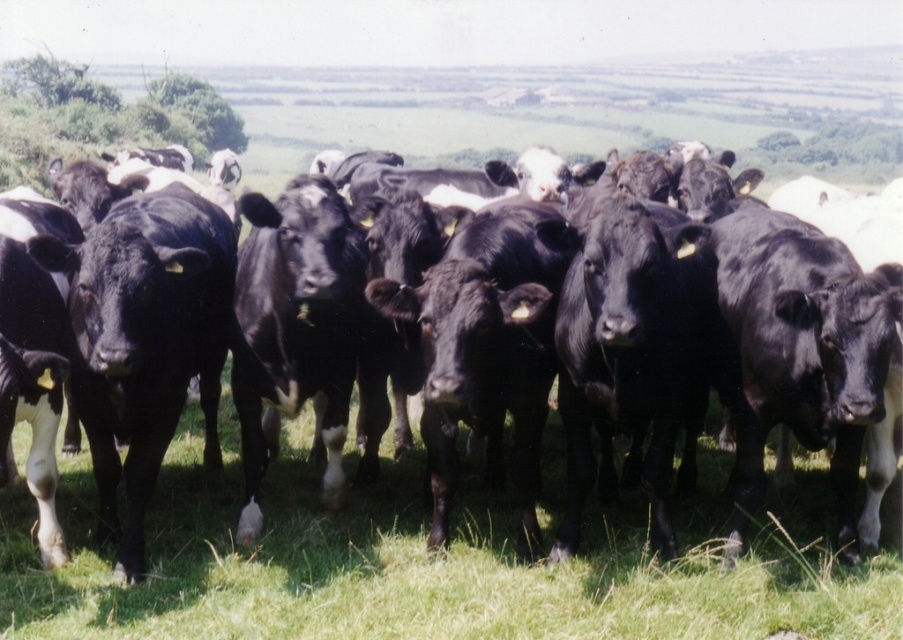
Is black glossy cows at center taller than green grass at center?

Correct, black glossy cows at center is much taller as green grass at center.

Who is shorter, black glossy cows at center or green grass at center?

Standing shorter between the two is green grass at center.

Does point (306, 257) come in front of point (811, 477)?

That is True.

Locate an element on the screen. The image size is (903, 640). black glossy cows at center is located at coordinates (529, 332).